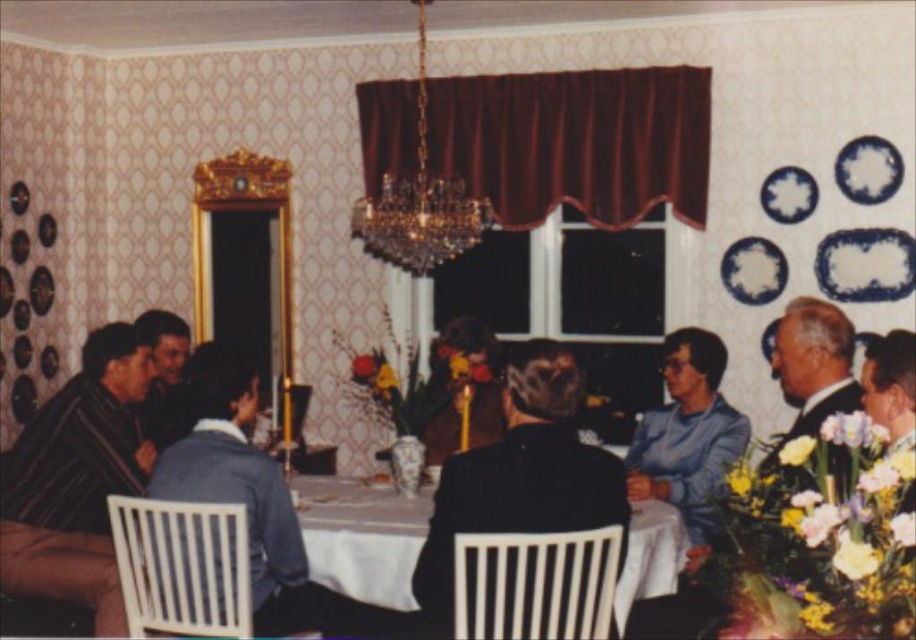
Question: Does crystal glass chandelier at upper center have a lesser width compared to dark gray suit at right?

Choices:
 (A) yes
 (B) no

Answer: (B)

Question: Can you confirm if striped fabric shirt at left is bigger than white glossy tablecloth at center?

Choices:
 (A) yes
 (B) no

Answer: (A)

Question: Is white glossy tablecloth at center in front of dark brown hair at center?

Choices:
 (A) yes
 (B) no

Answer: (A)

Question: Which point is farther to the camera?

Choices:
 (A) crystal glass chandelier at upper center
 (B) striped fabric shirt at left
 (C) white glossy tablecloth at center
 (D) dark brown hair at center

Answer: (A)

Question: Based on their relative distances, which object is nearer to the dark gray suit at right?

Choices:
 (A) striped fabric shirt at left
 (B) dark brown hair at center
 (C) white plastic table at center
 (D) white glossy tablecloth at center

Answer: (D)

Question: Which point appears farthest from the camera in this image?

Choices:
 (A) (326, 536)
 (B) (147, 460)
 (C) (805, 392)

Answer: (B)